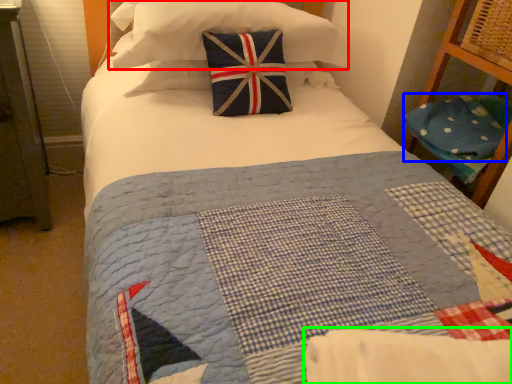
Question: Based on their relative distances, which object is nearer to pillow (highlighted by a red box)? Choose from pillow (highlighted by a blue box) and blanket (highlighted by a green box).

Choices:
 (A) pillow
 (B) blanket

Answer: (A)